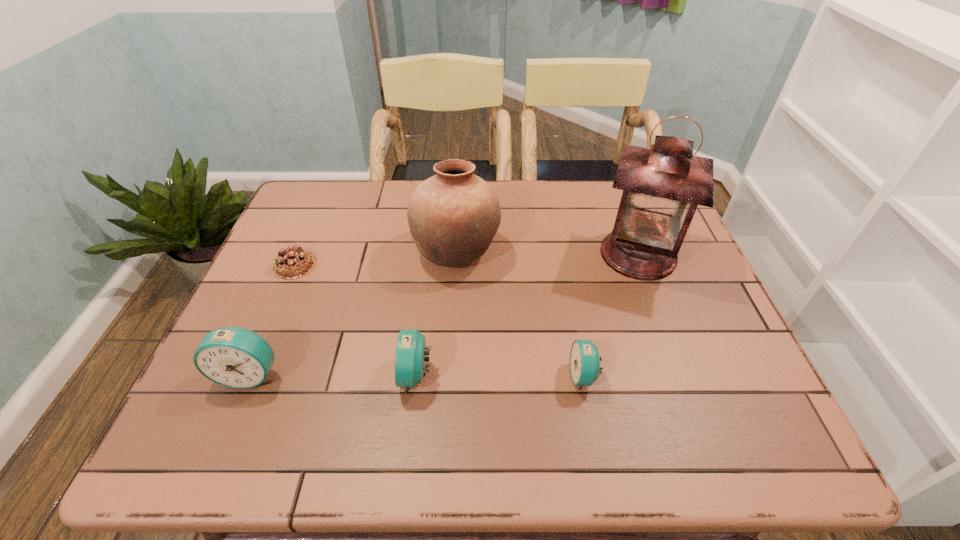
Find the location of a particular element. Image resolution: width=960 pixels, height=540 pixels. vacant space that's between the shortest object and the second shortest alarm clock is located at coordinates (355, 320).

Locate which object ranks in proximity to the shortest object. Please provide its 2D coordinates. Your answer should be formatted as a tuple, i.e. [(x, y)], where the tuple contains the x and y coordinates of a point satisfying the conditions above.

[(235, 357)]

The height and width of the screenshot is (540, 960). I want to click on object that stands as the closest to the tallest object, so click(x=585, y=360).

Where is `alarm clock that is the second closest one to the pottery`? This screenshot has height=540, width=960. alarm clock that is the second closest one to the pottery is located at coordinates (585, 360).

Identify which alarm clock is located as the second nearest to the tallest alarm clock. Please provide its 2D coordinates. Your answer should be formatted as a tuple, i.e. [(x, y)], where the tuple contains the x and y coordinates of a point satisfying the conditions above.

[(585, 360)]

Find the location of a particular element. free point that satisfies the following two spatial constraints: 1. on the front side of the tallest object; 2. on the front-facing side of the fifth object from left to right is located at coordinates (684, 376).